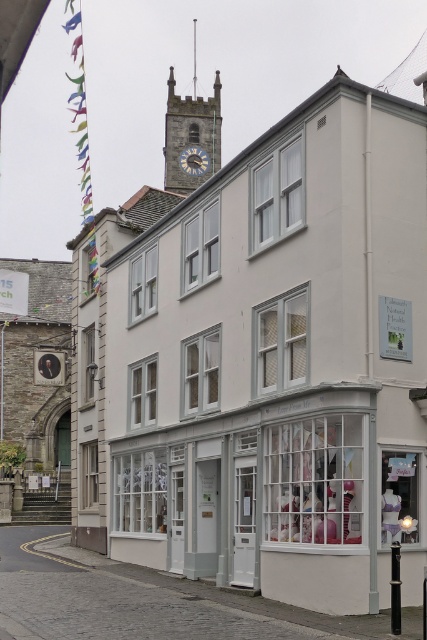
You are a tourist standing on the street looking at the buildings. You want to take a photo of the metallic clock face at center without the matte gray stone clock tower at upper center blocking it. Is this possible?

The matte gray stone clock tower at upper center is above the metallic clock face at center, so it will block the view of the metallic clock face at center. You cannot take a photo of the metallic clock face at center without the tower blocking it.

You are an architect designing a new building that needs to be placed between the matte gray stone clock tower at upper center and the metallic clock face at center. The new building must not exceed the height of the shorter object. Which object determines the maximum allowed height for your new building?

The metallic clock face at center is shorter than the matte gray stone clock tower at upper center, so the maximum allowed height for the new building is determined by the metallic clock face at center.

You are a painter standing in the street and want to paint both the matte gray stone clock tower at upper center and the metallic clock face at center. Which object should you focus on first if you want to paint the wider one first?

The matte gray stone clock tower at upper center is wider than the metallic clock face at center, so you should focus on painting the matte gray stone clock tower at upper center first.